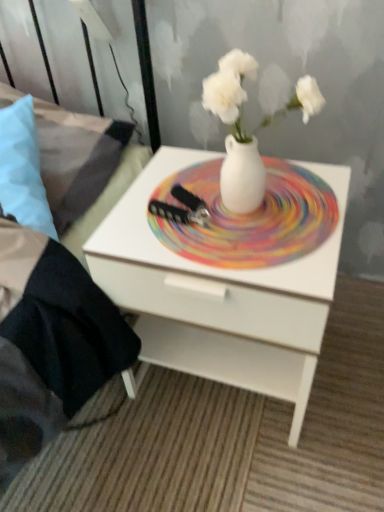
Question: Should I look upward or downward to see light blue fabric pillow at left?

Choices:
 (A) down
 (B) up

Answer: (B)

Question: Is brushed metal bed frame at left bigger than light blue fabric pillow at left?

Choices:
 (A) no
 (B) yes

Answer: (B)

Question: Does brushed metal bed frame at left turn towards light blue fabric pillow at left?

Choices:
 (A) yes
 (B) no

Answer: (A)

Question: Is brushed metal bed frame at left oriented away from light blue fabric pillow at left?

Choices:
 (A) yes
 (B) no

Answer: (B)

Question: Is light blue fabric pillow at left located within brushed metal bed frame at left?

Choices:
 (A) no
 (B) yes

Answer: (B)

Question: Does brushed metal bed frame at left come behind light blue fabric pillow at left?

Choices:
 (A) yes
 (B) no

Answer: (B)

Question: Can you confirm if brushed metal bed frame at left is positioned to the left of light blue fabric pillow at left?

Choices:
 (A) yes
 (B) no

Answer: (A)

Question: Can you confirm if white glossy nightstand at center is bigger than white glossy plate at center?

Choices:
 (A) no
 (B) yes

Answer: (B)

Question: Is white glossy nightstand at center closer to camera compared to white glossy plate at center?

Choices:
 (A) yes
 (B) no

Answer: (A)

Question: Is white glossy nightstand at center facing away from white glossy plate at center?

Choices:
 (A) yes
 (B) no

Answer: (B)

Question: From a real-world perspective, is white glossy nightstand at center below white glossy plate at center?

Choices:
 (A) yes
 (B) no

Answer: (A)

Question: Can we say white glossy nightstand at center lies outside white glossy plate at center?

Choices:
 (A) yes
 (B) no

Answer: (A)

Question: Does white glossy nightstand at center have a lesser height compared to white glossy plate at center?

Choices:
 (A) yes
 (B) no

Answer: (B)

Question: Does white glossy nightstand at center have a lesser height compared to brushed metal bed frame at left?

Choices:
 (A) yes
 (B) no

Answer: (B)